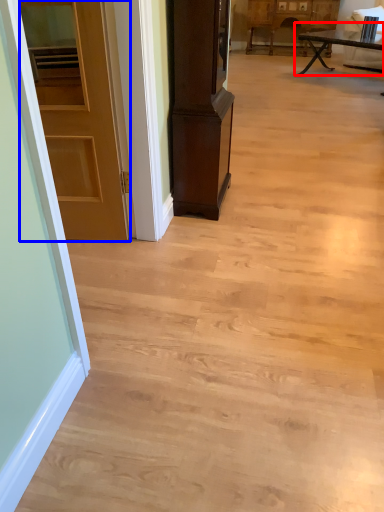
Question: Which point is closer to the camera, table (highlighted by a red box) or door (highlighted by a blue box)?

Choices:
 (A) table
 (B) door

Answer: (B)